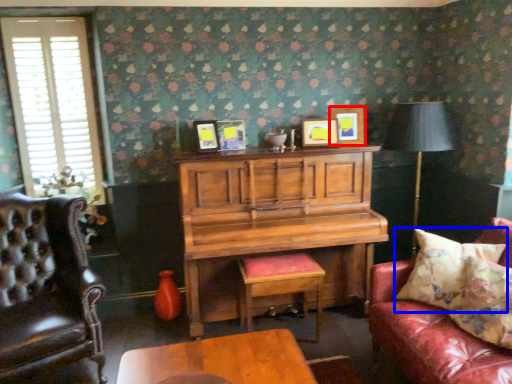
Question: Which of the following is the closest to the observer, picture frame (highlighted by a red box) or pillow (highlighted by a blue box)?

Choices:
 (A) picture frame
 (B) pillow

Answer: (B)